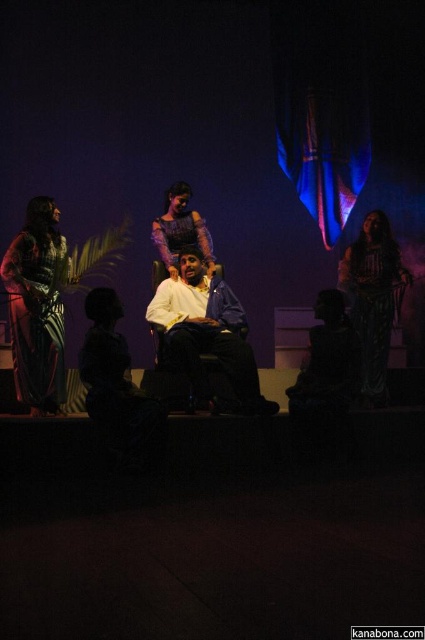
Identify the location of plaid fabric dress at left. The image size is (425, 640). (37, 307).

Does plaid fabric dress at left appear over matte purple dress at center?

No.

Find the location of a particular element. The height and width of the screenshot is (640, 425). plaid fabric dress at left is located at coordinates (37, 307).

Can you confirm if silky green dress at right is thinner than matte purple dress at center?

Indeed, silky green dress at right has a lesser width compared to matte purple dress at center.

Does silky green dress at right come in front of matte purple dress at center?

Yes.

What do you see at coordinates (373, 298) in the screenshot? The image size is (425, 640). I see `silky green dress at right` at bounding box center [373, 298].

Identify the location of silky green dress at right. (373, 298).

Is point (19, 241) behind point (382, 333)?

No, (19, 241) is in front of (382, 333).

Does plaid fabric dress at left lie in front of silky green dress at right?

Yes, it is.

The height and width of the screenshot is (640, 425). I want to click on plaid fabric dress at left, so pyautogui.click(x=37, y=307).

This screenshot has height=640, width=425. I want to click on plaid fabric dress at left, so click(x=37, y=307).